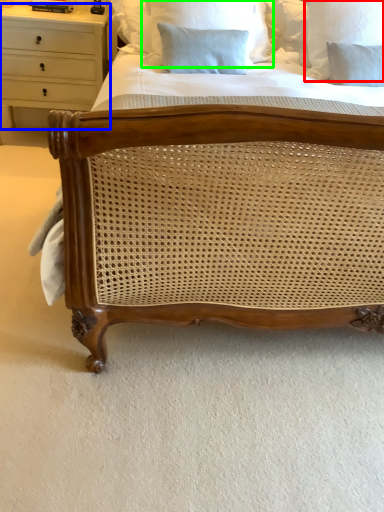
Question: Considering the real-world distances, which object is farthest from pillow (highlighted by a red box)? chest of drawers (highlighted by a blue box) or pillow (highlighted by a green box)?

Choices:
 (A) chest of drawers
 (B) pillow

Answer: (A)